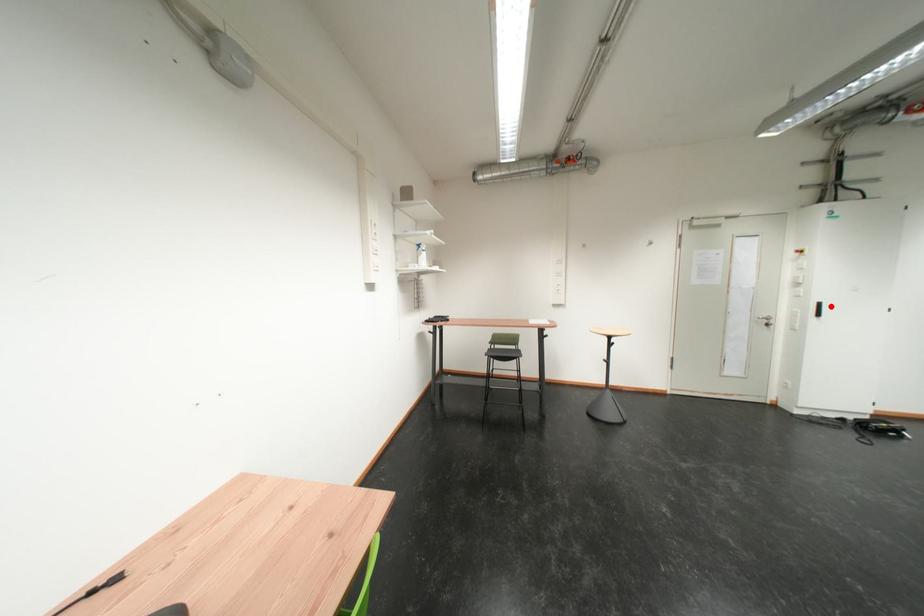
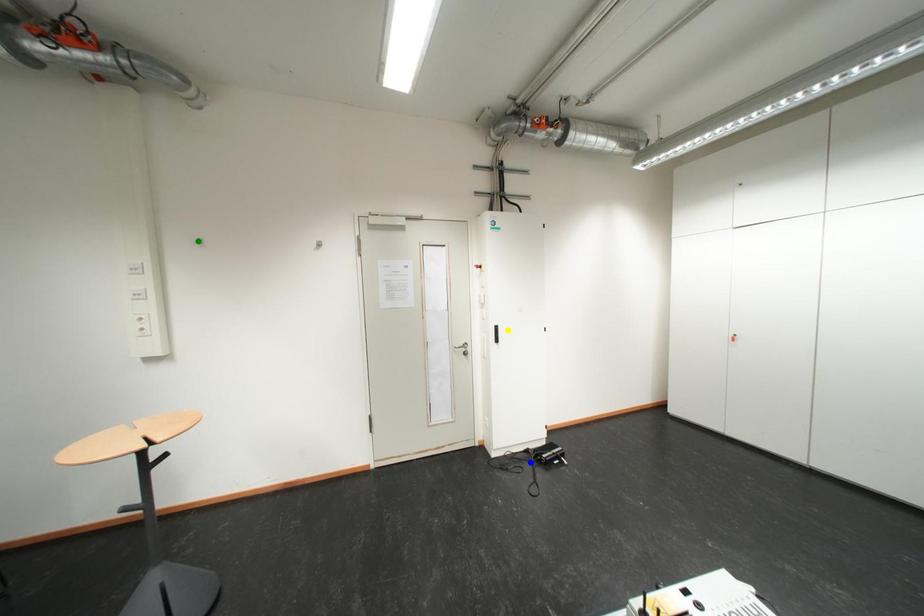
Question: I am providing you with two images of the same scene from different viewpoints. A red point is marked on the first image. You are given multiple points on the second image. Which point in image 2 is actually the same real-world point as the red point in image 1?

Choices:
 (A) yellow point
 (B) blue point
 (C) green point

Answer: (A)